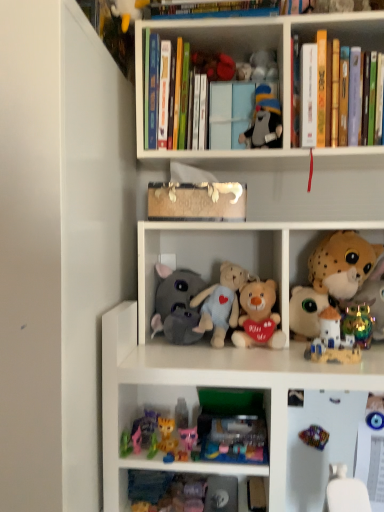
Question: In terms of size, does matte plastic castle at center right, the sixth toy positioned from the top, appear bigger or smaller than rainbow metallic figurine at right, which is the third toy from bottom to top?

Choices:
 (A) small
 (B) big

Answer: (B)

Question: From the image's perspective, relative to rainbow metallic figurine at right, the seventh toy positioned from the top, is matte plastic castle at center right, positioned as the fourth toy in bottom-to-top order, above or below?

Choices:
 (A) below
 (B) above

Answer: (B)

Question: Considering the real-world distances, which object is farthest from the hardcover books at upper center, arranged as the 1th shelf when viewed from the top?

Choices:
 (A) fluffy white stuffed animal at center-right, which ranks as the sixth toy in bottom-to-top order
 (B) multicolored plastic toy at lower right, the first toy from the bottom
 (C) plush pink bear at center, the 8th toy when ordered from top to bottom
 (D) fluffy white stuffed animal at right, which appears as the 2th toy when viewed from the top
 (E) rainbow metallic figurine at right, which is the third toy from bottom to top

Answer: (B)

Question: Considering the real-world distances, which object is closest to the fluffy white stuffed animal at right, which appears as the 2th toy when viewed from the top?

Choices:
 (A) hardcover books at upper right, the 3th book positioned from the left
 (B) gray plush elephant at center, the 7th toy positioned from the bottom
 (C) hardcover books at upper center, the second shelf positioned from the bottom
 (D) rainbow metallic figurine at right, which is the third toy from bottom to top
 (E) gray fabric stuffed animal at upper center, positioned as the first toy in top-to-bottom order

Answer: (D)